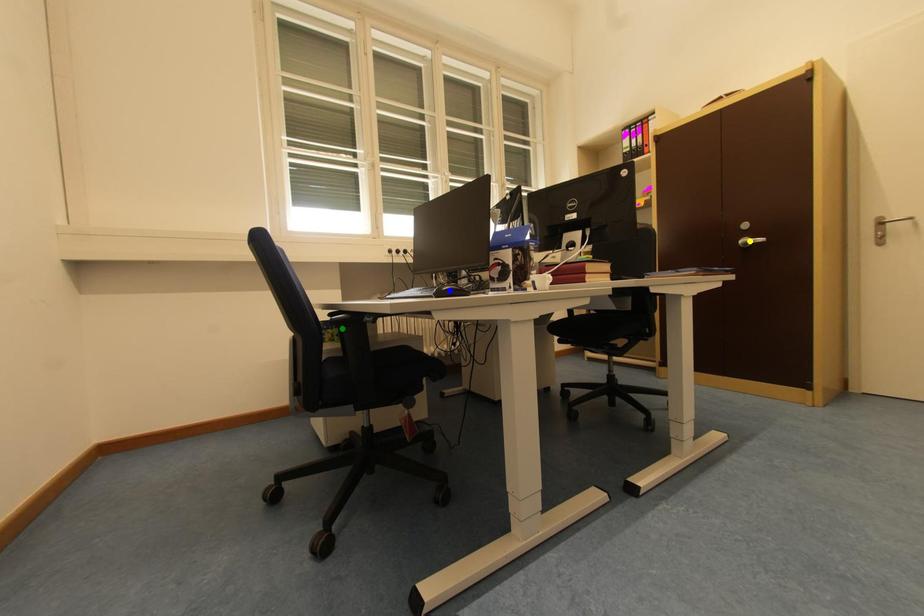
Order these from farthest to nearest:
blue point | green point | yellow point

green point → yellow point → blue point